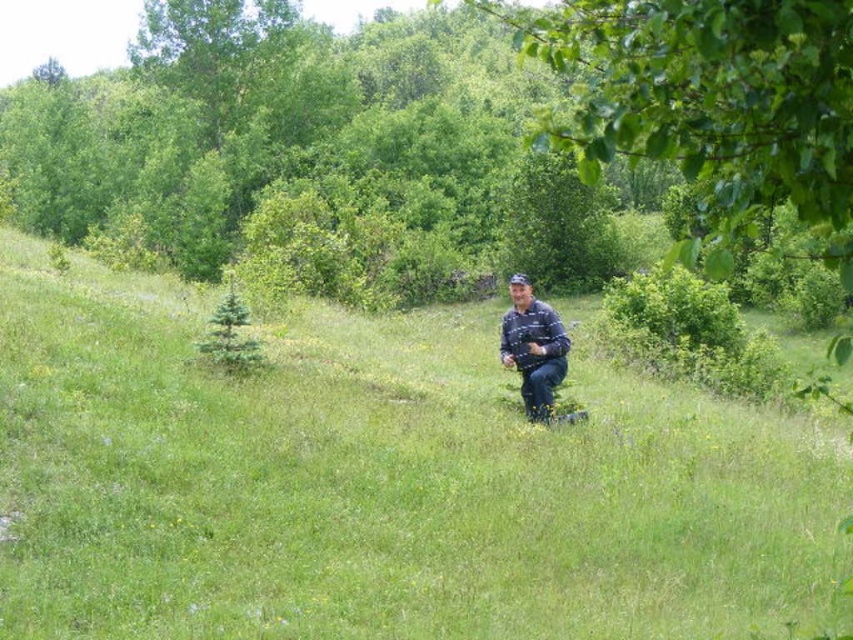
Does green grassy at center have a lesser width compared to blue denim jeans at center?

No, green grassy at center is not thinner than blue denim jeans at center.

Who is positioned more to the left, green grassy at center or blue denim jeans at center?

From the viewer's perspective, green grassy at center appears more on the left side.

The width and height of the screenshot is (853, 640). Identify the location of green grassy at center. (379, 483).

Locate an element on the screen. The height and width of the screenshot is (640, 853). green grassy at center is located at coordinates (379, 483).